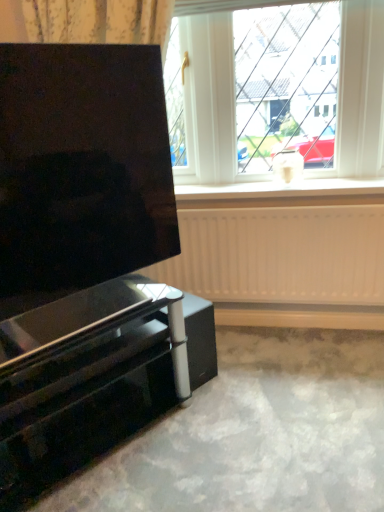
Question: Looking at their shapes, would you say white matte window sill at center is wider or thinner than white matte radiator at lower center?

Choices:
 (A) thin
 (B) wide

Answer: (B)

Question: In terms of size, does white matte window sill at center appear bigger or smaller than white matte radiator at lower center?

Choices:
 (A) small
 (B) big

Answer: (A)

Question: Estimate the real-world distances between objects in this image. Which object is closer to the glossy black tv stand at lower left?

Choices:
 (A) white matte radiator at lower center
 (B) matte black screen at left
 (C) white matte window sill at center
 (D) white plastic window at upper center

Answer: (B)

Question: Estimate the real-world distances between objects in this image. Which object is farther from the matte black screen at left?

Choices:
 (A) white plastic window at upper center
 (B) glossy black tv stand at lower left
 (C) white matte radiator at lower center
 (D) white matte window sill at center

Answer: (A)